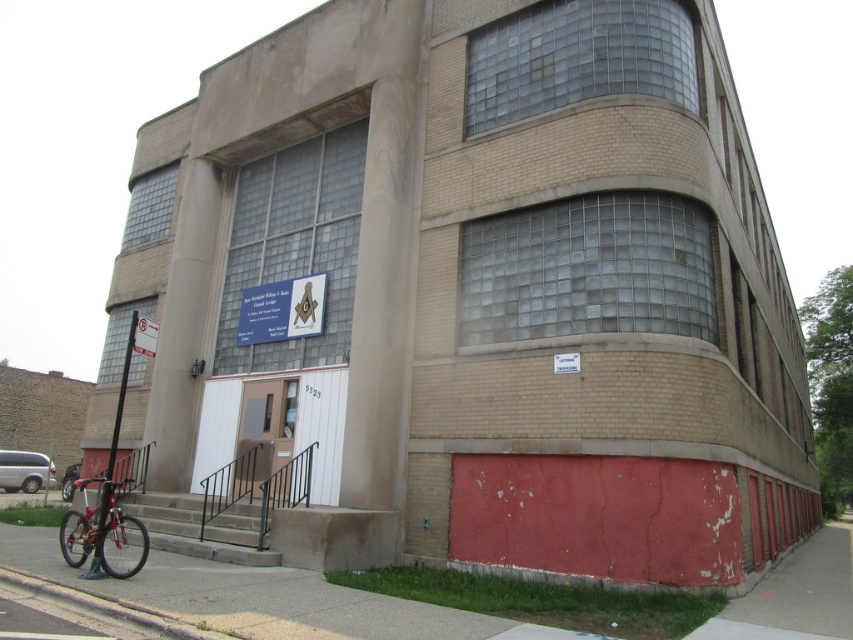
Is beige concrete pillar at left shorter than white paper sign at upper left?

No.

Who is higher up, beige concrete pillar at left or white paper sign at upper left?

beige concrete pillar at left is higher up.

Who is more distant from viewer, (x=184, y=179) or (x=143, y=342)?

The point (x=184, y=179) is more distant.

Locate an element on the screen. The height and width of the screenshot is (640, 853). beige concrete pillar at left is located at coordinates (x=183, y=328).

Which is behind, point (196, 362) or point (318, 316)?

Point (196, 362)

Is beige concrete pillar at left shorter than white matte sign at center?

No.

Is point (198, 186) in front of point (312, 276)?

No, it is behind (312, 276).

At what (x,y) coordinates should I click in order to perform the action: click on beige concrete pillar at left. Please return your answer as a coordinate pair (x, y). This screenshot has width=853, height=640. Looking at the image, I should click on (183, 328).

Is red matte bicycle at lower left positioned behind white matte sign at center?

No.

Which is above, red matte bicycle at lower left or white matte sign at center?

Positioned higher is white matte sign at center.

Does point (108, 564) lie behind point (252, 326)?

No, (108, 564) is closer to viewer.

Image resolution: width=853 pixels, height=640 pixels. What are the coordinates of `red matte bicycle at lower left` in the screenshot? It's located at (103, 534).